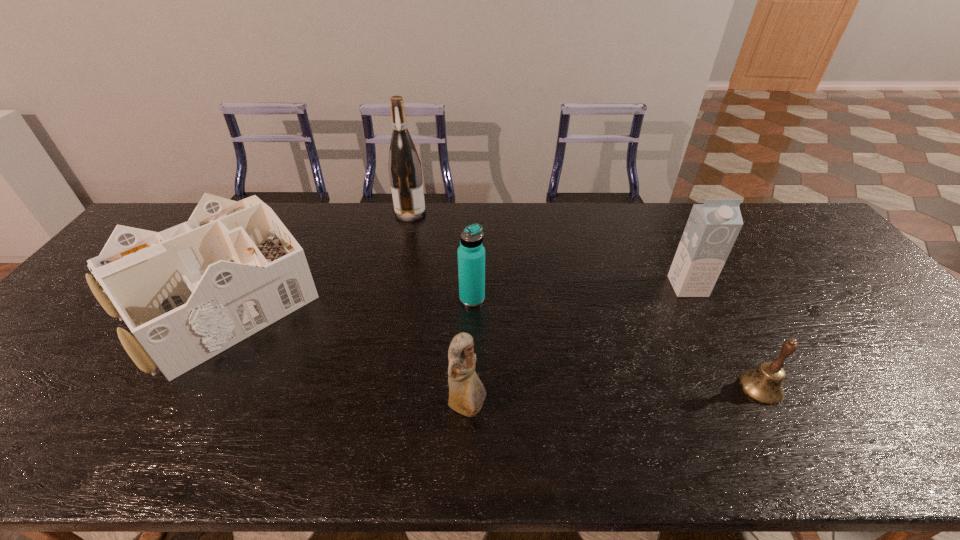
You are a GUI agent. You are given a task and a screenshot of the screen. Output one action in this format:
    pyautogui.click(x=<x>, y=<y>)
    Task: Click on the vacant space at the far right corner of the desktop
    This screenshot has width=960, height=540.
    Given the screenshot: What is the action you would take?
    pyautogui.click(x=787, y=230)

The width and height of the screenshot is (960, 540). Find the location of `vacant region between the farthest object and the leftmost object`. vacant region between the farthest object and the leftmost object is located at coordinates (317, 258).

Where is `empty location between the fifth shortest object and the water bottle`? The width and height of the screenshot is (960, 540). empty location between the fifth shortest object and the water bottle is located at coordinates (580, 293).

The image size is (960, 540). What are the coordinates of `free area in between the fifth shortest object and the figurine` in the screenshot? It's located at (578, 347).

Image resolution: width=960 pixels, height=540 pixels. I want to click on free area in between the shortest object and the leftmost object, so click(x=492, y=345).

What are the coordinates of `free area in between the farthest object and the figurine` in the screenshot? It's located at pyautogui.click(x=439, y=310).

Where is `unoccupied area between the second object from left to right and the shortest object`? This screenshot has width=960, height=540. unoccupied area between the second object from left to right and the shortest object is located at coordinates (586, 300).

The width and height of the screenshot is (960, 540). I want to click on free spot between the figurine and the shortest object, so click(x=614, y=398).

Identify the location of vacant space that's between the figurine and the carton. This screenshot has height=540, width=960. (578, 347).

Find the location of a particular element. Image resolution: width=960 pixels, height=540 pixels. empty space between the fifth object from right to left and the water bottle is located at coordinates (442, 255).